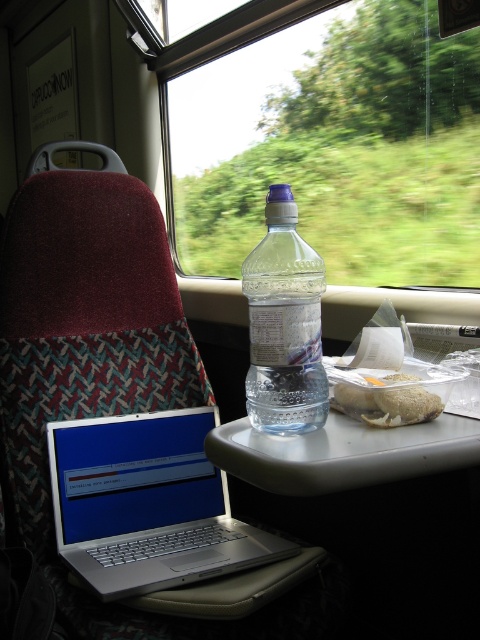
The image size is (480, 640). Identify the location of silver metallic laptop at lower left. (147, 504).

Describe the element at coordinates (147, 504) in the screenshot. This screenshot has width=480, height=640. I see `silver metallic laptop at lower left` at that location.

Does point (201, 435) come in front of point (443, 403)?

No.

Where is `silver metallic laptop at lower left`? The width and height of the screenshot is (480, 640). silver metallic laptop at lower left is located at coordinates (147, 504).

Is silver metallic laptop at lower left to the right of clear plastic bottle at center from the viewer's perspective?

In fact, silver metallic laptop at lower left is to the left of clear plastic bottle at center.

The height and width of the screenshot is (640, 480). What are the coordinates of `silver metallic laptop at lower left` in the screenshot? It's located at (147, 504).

Is point (51, 467) farther from camera compared to point (271, 417)?

Yes, it is behind point (271, 417).

The image size is (480, 640). I want to click on silver metallic laptop at lower left, so click(147, 504).

Does transparent plastic bottle at upper center have a smaller size compared to clear plastic tray at center?

Incorrect, transparent plastic bottle at upper center is not smaller in size than clear plastic tray at center.

Is point (395, 90) farther from viewer compared to point (272, 460)?

Yes, point (395, 90) is behind point (272, 460).

Who is more distant from viewer, (x=345, y=6) or (x=444, y=452)?

The point (x=345, y=6) is behind.

Locate an element on the screen. This screenshot has width=480, height=640. transparent plastic bottle at upper center is located at coordinates (336, 147).